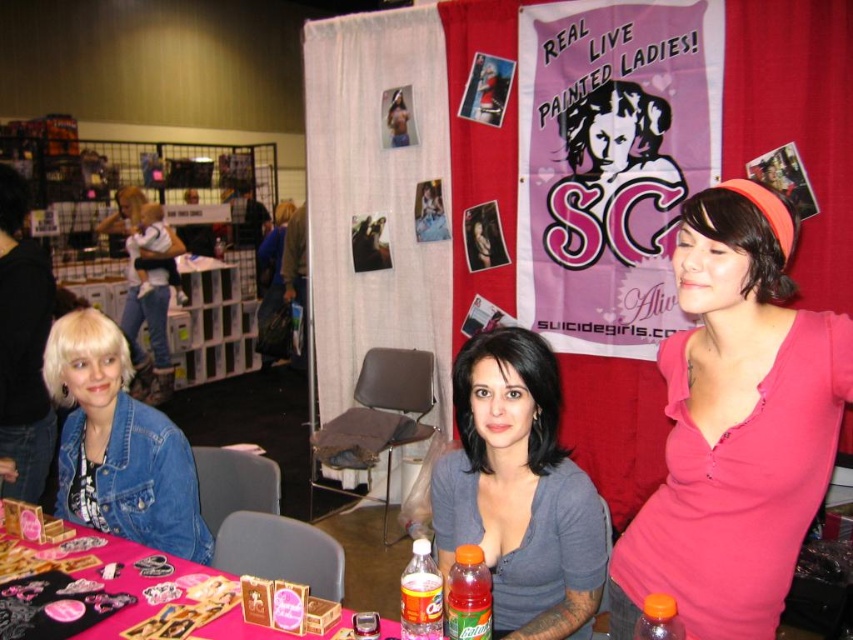
From the picture: You are organizing a small booth at the event and need to place a new item on the table. The table has limited space between the denim jacket at lower left and the orange plastic bottle at lower center. Which object should you move to make room for the new item if you want to keep the other in its current position?

You should move the denim jacket at lower left because it might be wider than the orange plastic bottle at lower center, so moving the wider object would create more space.

You are a photographer at the event and need to take a photo of the gray matte shirt at center. Your camera is 4.53 feet away from the shirt. Is this distance within the optimal focus range of 3 to 5 feet for your camera lens?

The gray matte shirt at center and camera are 4.53 feet apart. Since the optimal focus range is 3 to 5 feet, the distance of 4.53 feet falls within this range, so the camera can focus properly on the gray matte shirt at center.

You are organizing a photo shoot and need to ensure that the gray matte shirt at center and the orange plastic bottle at lower center are both visible in the frame. Based on their sizes, which object should you prioritize positioning closer to the camera to avoid being obscured?

The gray matte shirt at center might be wider than orange plastic bottle at lower center, so you should prioritize positioning the orange plastic bottle at lower center closer to the camera to ensure it is visible.